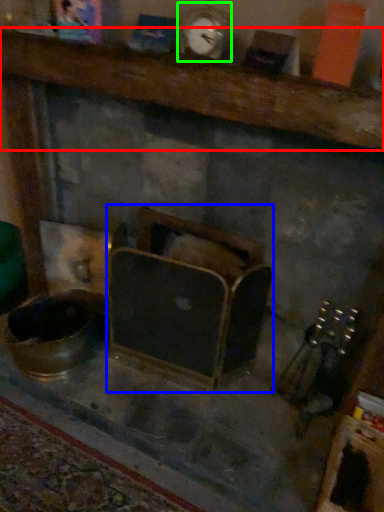
Question: Which object is positioned farthest from furniture (highlighted by a red box)? Select from furniture (highlighted by a blue box) and clock (highlighted by a green box).

Choices:
 (A) furniture
 (B) clock

Answer: (A)